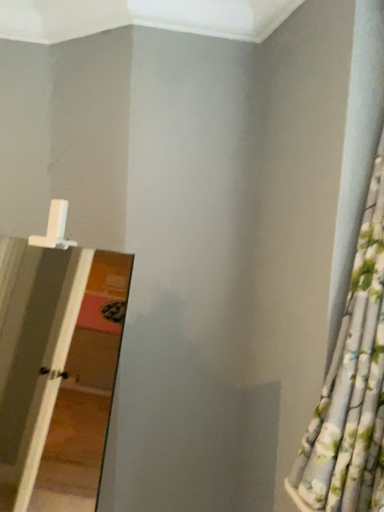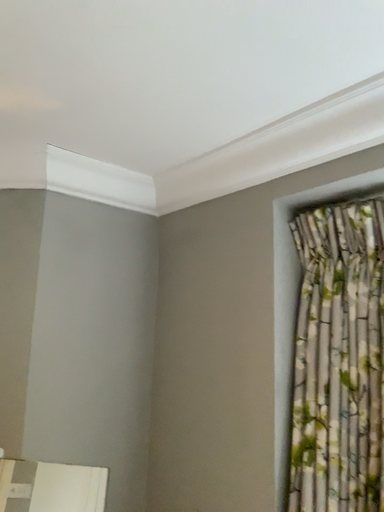
Question: Which way did the camera rotate in the video?

Choices:
 (A) rotated downward
 (B) rotated upward

Answer: (B)